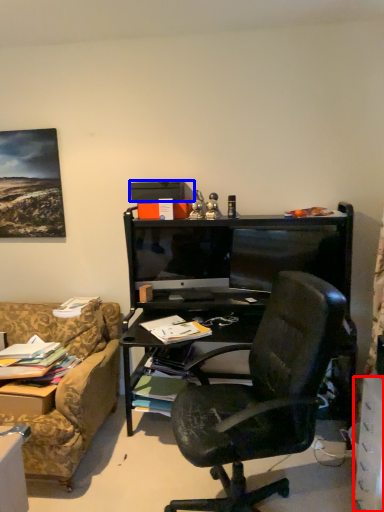
Question: Which of the following is the closest to the observer, drawer (highlighted by a red box) or box (highlighted by a blue box)?

Choices:
 (A) drawer
 (B) box

Answer: (A)